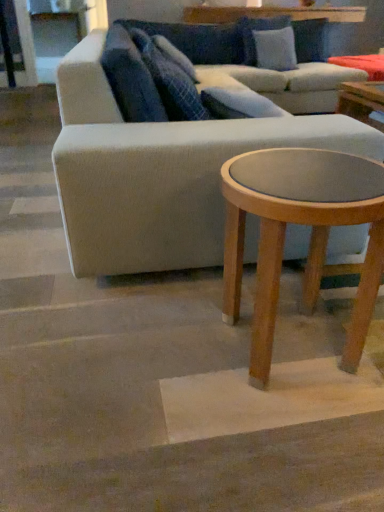
Question: Considering the relative sizes of blue textured pillow at upper center, placed as the 1th pillow when sorted from left to right, and light brown wood coffee table at lower right in the image provided, is blue textured pillow at upper center, placed as the 1th pillow when sorted from left to right, thinner than light brown wood coffee table at lower right?

Choices:
 (A) no
 (B) yes

Answer: (B)

Question: Does blue textured pillow at upper center, marked as the first pillow in a front-to-back arrangement, have a smaller size compared to light brown wood coffee table at lower right?

Choices:
 (A) yes
 (B) no

Answer: (B)

Question: Is blue textured pillow at upper center, the second pillow positioned from the top, positioned beyond the bounds of light brown wood coffee table at lower right?

Choices:
 (A) yes
 (B) no

Answer: (A)

Question: From a real-world perspective, is blue textured pillow at upper center, arranged as the third pillow when viewed from the right, located beneath light brown wood coffee table at lower right?

Choices:
 (A) no
 (B) yes

Answer: (A)

Question: Does blue textured pillow at upper center, the second pillow when ordered from bottom to top, have a lesser height compared to light brown wood coffee table at lower right?

Choices:
 (A) no
 (B) yes

Answer: (B)

Question: Is blue textured pillow at upper center, placed as the 1th pillow when sorted from left to right, positioned behind light brown wood coffee table at lower right?

Choices:
 (A) no
 (B) yes

Answer: (B)

Question: Does blue textured pillow at upper center, arranged as the third pillow when viewed from the right, appear on the right side of light blue fabric pillow at upper center, the 3th pillow from the left?

Choices:
 (A) yes
 (B) no

Answer: (B)

Question: Could you tell me if blue textured pillow at upper center, the second pillow positioned from the top, is facing light blue fabric pillow at upper center, arranged as the first pillow when viewed from the right?

Choices:
 (A) no
 (B) yes

Answer: (A)

Question: From a real-world perspective, is blue textured pillow at upper center, placed as the 1th pillow when sorted from left to right, below light blue fabric pillow at upper center, the first pillow when ordered from top to bottom?

Choices:
 (A) yes
 (B) no

Answer: (A)

Question: Considering the relative sizes of blue textured pillow at upper center, the second pillow when ordered from bottom to top, and light blue fabric pillow at upper center, the 3th pillow from the left, in the image provided, is blue textured pillow at upper center, the second pillow when ordered from bottom to top, taller than light blue fabric pillow at upper center, the 3th pillow from the left,?

Choices:
 (A) no
 (B) yes

Answer: (A)

Question: From the image's perspective, is blue textured pillow at upper center, the second pillow when ordered from bottom to top, below light blue fabric pillow at upper center, the 3th pillow from the left?

Choices:
 (A) yes
 (B) no

Answer: (A)

Question: Are blue textured pillow at upper center, the second pillow when ordered from bottom to top, and light blue fabric pillow at upper center, acting as the third pillow starting from the front, located far from each other?

Choices:
 (A) no
 (B) yes

Answer: (B)

Question: Considering the relative sizes of blue textured pillow at upper center, placed as the 3th pillow when sorted from top to bottom, and light gray fabric couch at center in the image provided, is blue textured pillow at upper center, placed as the 3th pillow when sorted from top to bottom, thinner than light gray fabric couch at center?

Choices:
 (A) yes
 (B) no

Answer: (A)